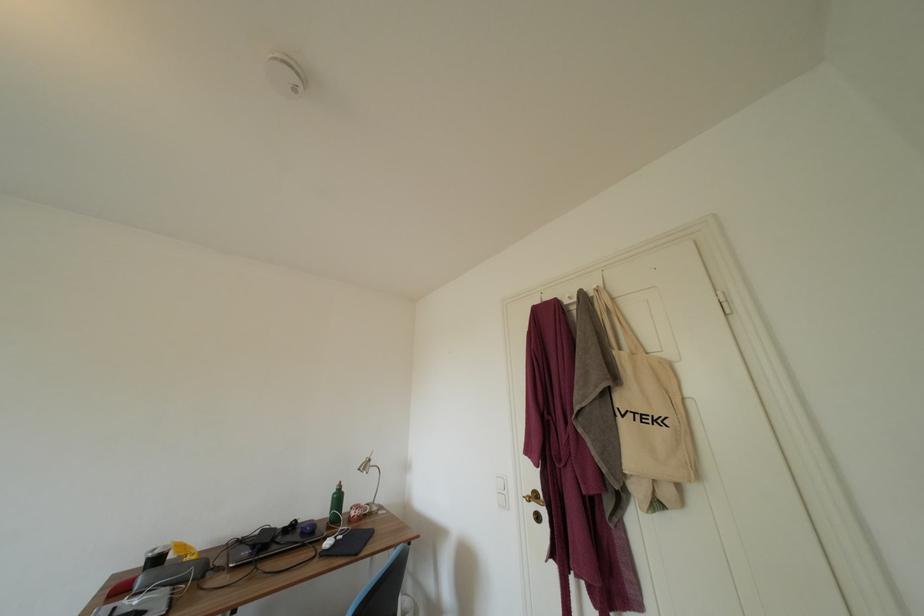
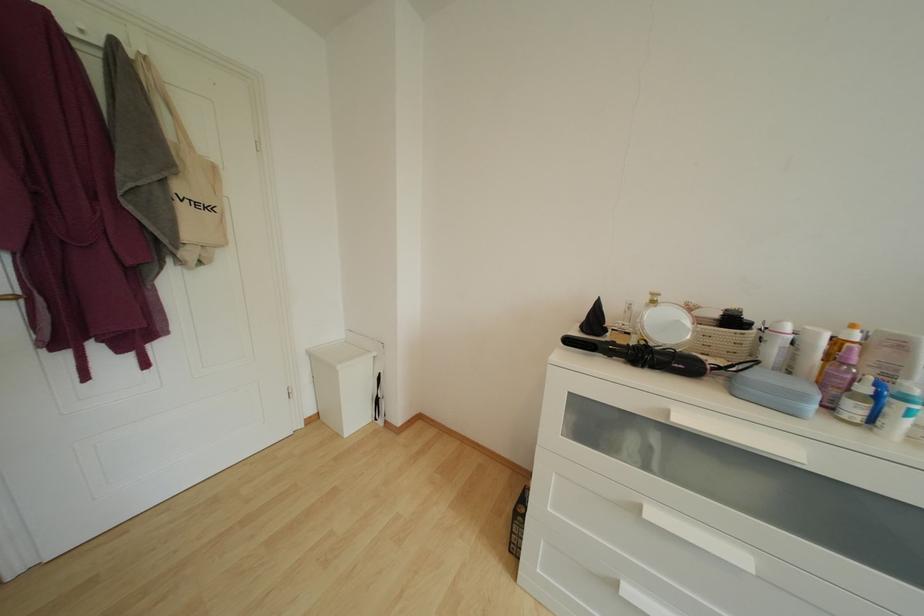
Question: The camera is either moving clockwise (left) or counter-clockwise (right) around the object. The first image is from the beginning of the video and the second image is from the end. Is the camera moving left or right when shooting the video?

Choices:
 (A) Left
 (B) Right

Answer: (A)